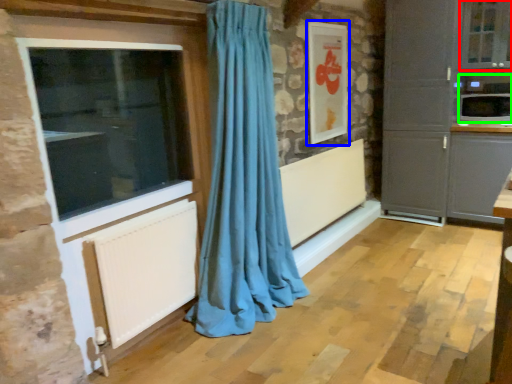
Question: Which object is the farthest from window (highlighted by a red box)? Choose among these: picture frame (highlighted by a blue box) or appliance (highlighted by a green box).

Choices:
 (A) picture frame
 (B) appliance

Answer: (A)